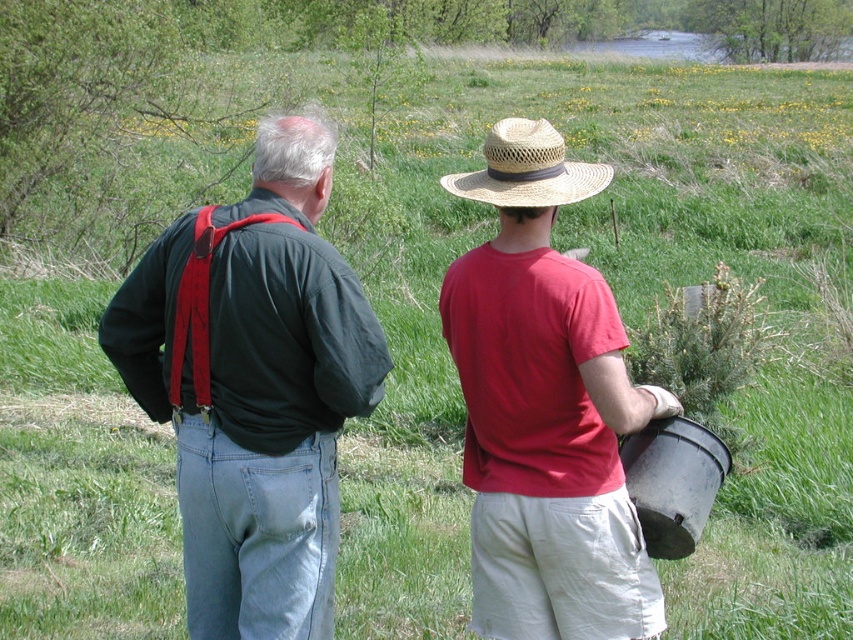
You are a photographer trying to capture both the dark green shirt at left and the straw hat at center in the same frame. Based on their positions, which one should you focus on first to ensure both are in the frame?

The dark green shirt at left is located below the straw hat at center, so you should focus on the straw hat at center first to ensure both are in the frame.